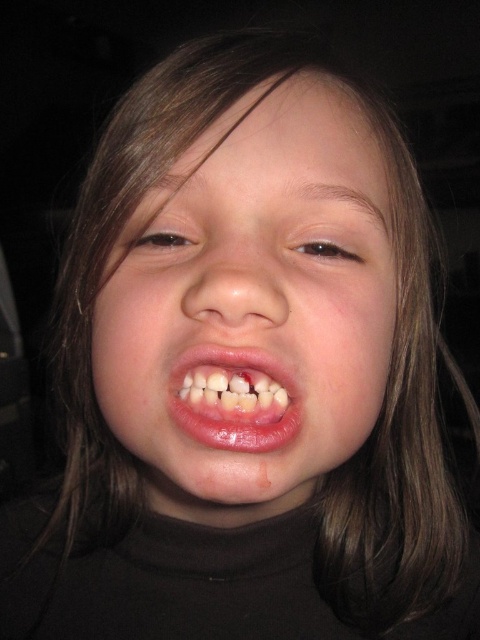
You are a dentist who needs to examine the child. The smooth skin face at center is 9.37 inches away from your current position. Can you clearly see the child for examination without moving closer?

The smooth skin face at center is 9.37 inches away, which is close enough for a dentist to examine the child clearly without needing to move closer.

You are a photographer adjusting the focus of your camera. The subject has a smooth skin face at center. Where should you position the focus point to ensure the face is in sharp focus?

You should position the focus point at the 2D location of the smooth skin face at center, which is at point (252, 305), to ensure the face is in sharp focus.